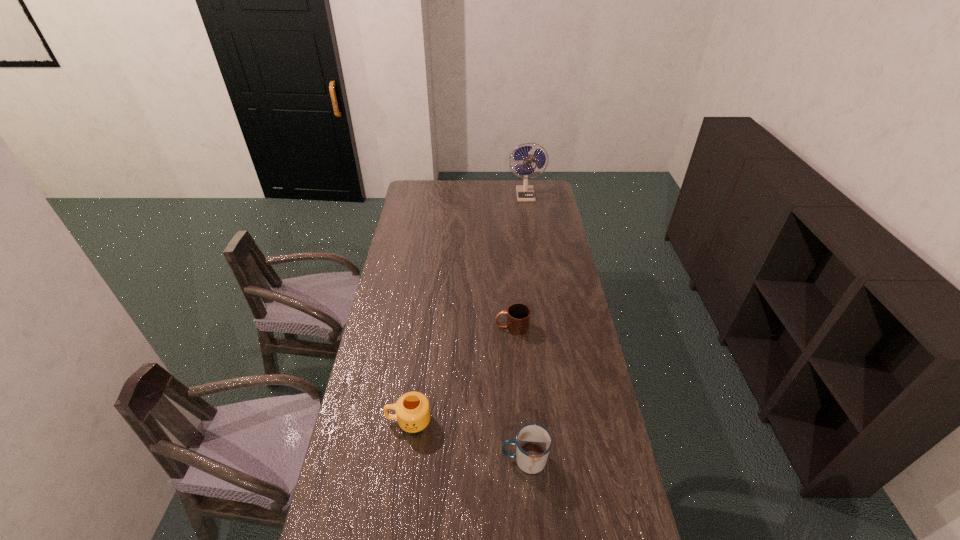
This screenshot has width=960, height=540. Find the location of `vacant space located on the handle side of the nearest object`. vacant space located on the handle side of the nearest object is located at coordinates (425, 460).

Where is `vacant space located 0.050m on the handle side of the second farthest mug`? vacant space located 0.050m on the handle side of the second farthest mug is located at coordinates (371, 421).

Find the location of a particular element. free space located on the handle side of the second farthest mug is located at coordinates (371, 421).

What are the coordinates of `blank area located on the handle side of the second farthest mug` in the screenshot? It's located at (359, 421).

Where is `vacant point located 0.120m on the side of the shortest object with the handle`? The height and width of the screenshot is (540, 960). vacant point located 0.120m on the side of the shortest object with the handle is located at coordinates (464, 327).

You are a GUI agent. You are given a task and a screenshot of the screen. Output one action in this format:
    pyautogui.click(x=<x>, y=<y>)
    Task: Click on the vacant space situated on the side of the shortest object with the handle
    
    Given the screenshot: What is the action you would take?
    pyautogui.click(x=467, y=327)

The width and height of the screenshot is (960, 540). What are the coordinates of `vacant space located on the side of the shortest object with the handle` in the screenshot? It's located at (441, 327).

Where is `object that is at the far edge`? object that is at the far edge is located at coordinates (524, 193).

Locate an element on the screen. object at the left edge is located at coordinates (412, 409).

Where is `object that is at the right edge`? This screenshot has height=540, width=960. object that is at the right edge is located at coordinates (524, 193).